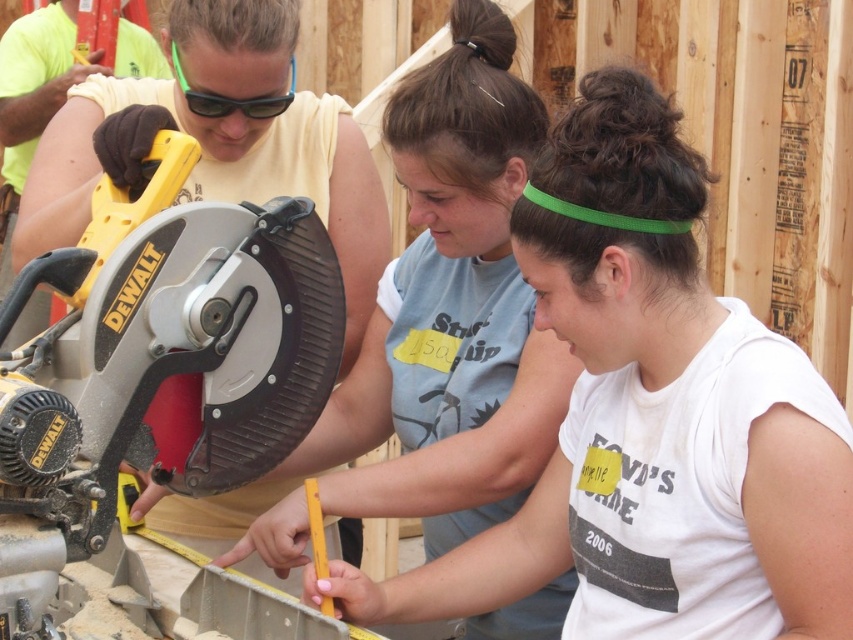
You are standing at the center of the image. Which direction should you move to reach the yellow plastic circular saw at left?

The yellow plastic circular saw at left is located at point (x=155, y=362), so you should move to the left to reach it.

You are a safety inspector checking the equipment at the construction site. You notice the matte yellow shirt at center and the green plastic goggles at upper center. Which object is taller in the image?

The matte yellow shirt at center is taller than the green plastic goggles at upper center.

You are a safety inspector at the construction site. You notice two items in the image that are part of the worker safety gear. The items are the matte yellow shirt at center and the green plastic goggles at upper center. According to the image, which item is positioned to the right of the other?

The matte yellow shirt at center is to the right of green plastic goggles at upper center.